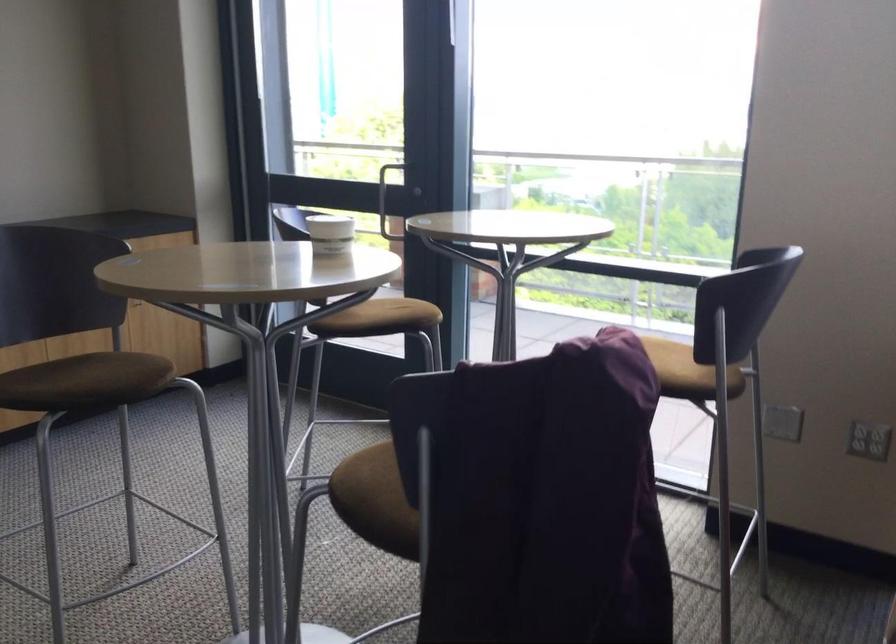
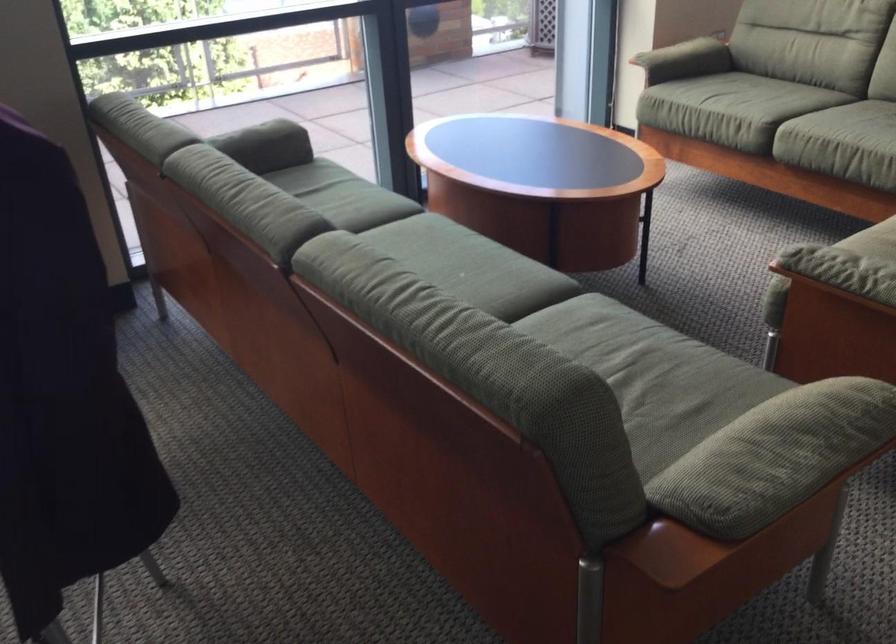
Based on the continuous images, in which direction is the camera rotating?

The camera's rotation is toward right-down.